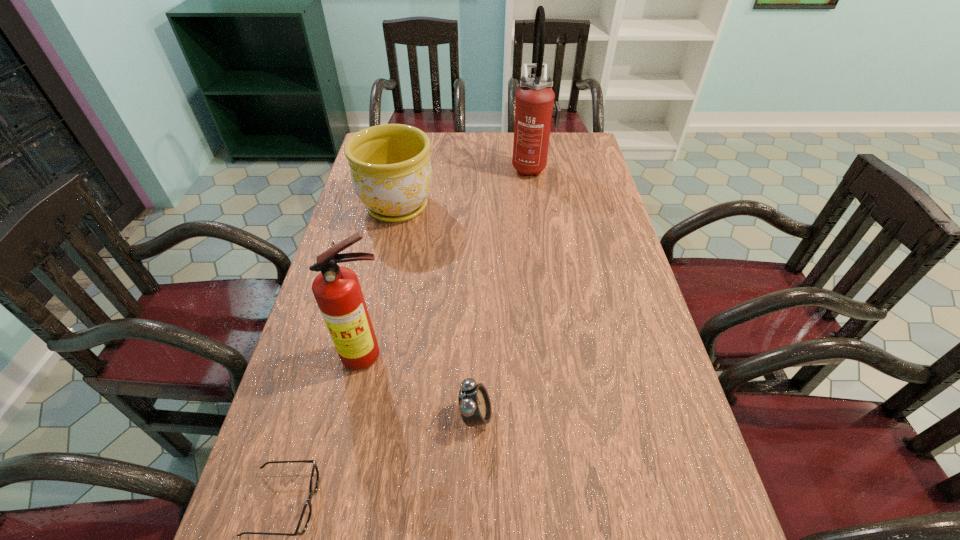
Where is `object that can be found as the second closest to the nearer fire extinguisher`? Image resolution: width=960 pixels, height=540 pixels. object that can be found as the second closest to the nearer fire extinguisher is located at coordinates click(x=306, y=513).

This screenshot has height=540, width=960. What are the coordinates of `vacant space that satisfies the following two spatial constraints: 1. at the nozzle of the right fire extinguisher; 2. on the front-facing side of the shorter fire extinguisher` in the screenshot? It's located at (559, 355).

I want to click on free location that satisfies the following two spatial constraints: 1. at the nozzle of the farther fire extinguisher; 2. on the front-facing side of the second tallest object, so (x=559, y=355).

Find the location of a particular element. vacant area in the image that satisfies the following two spatial constraints: 1. at the nozzle of the right fire extinguisher; 2. on the front side of the second farthest object is located at coordinates (538, 206).